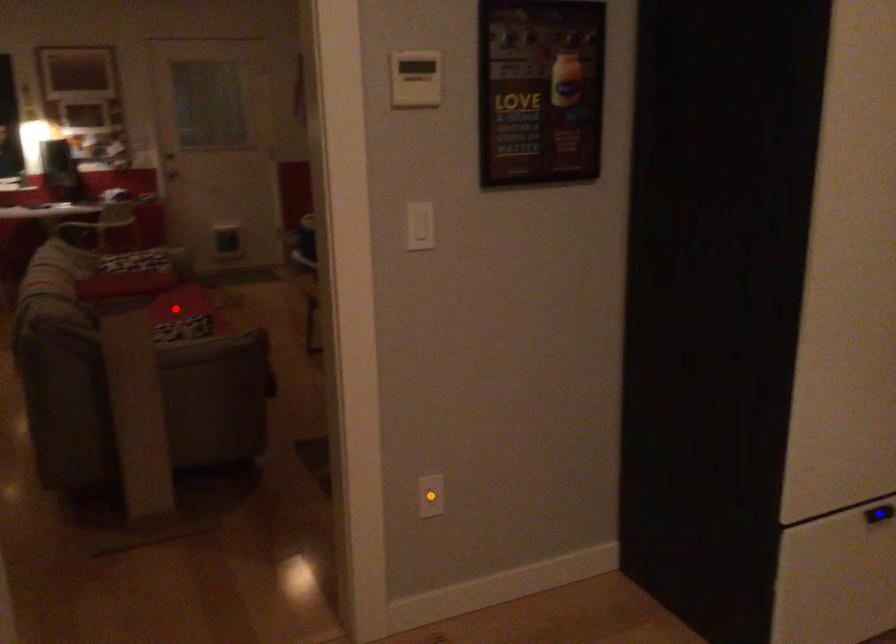
Order these from nearest to farthest:
orange point | red point | blue point

blue point < orange point < red point